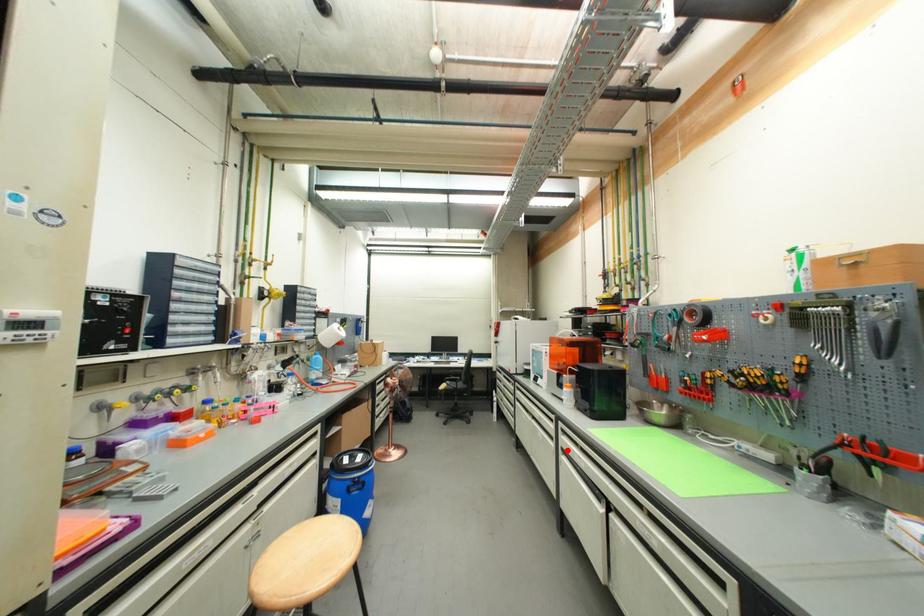
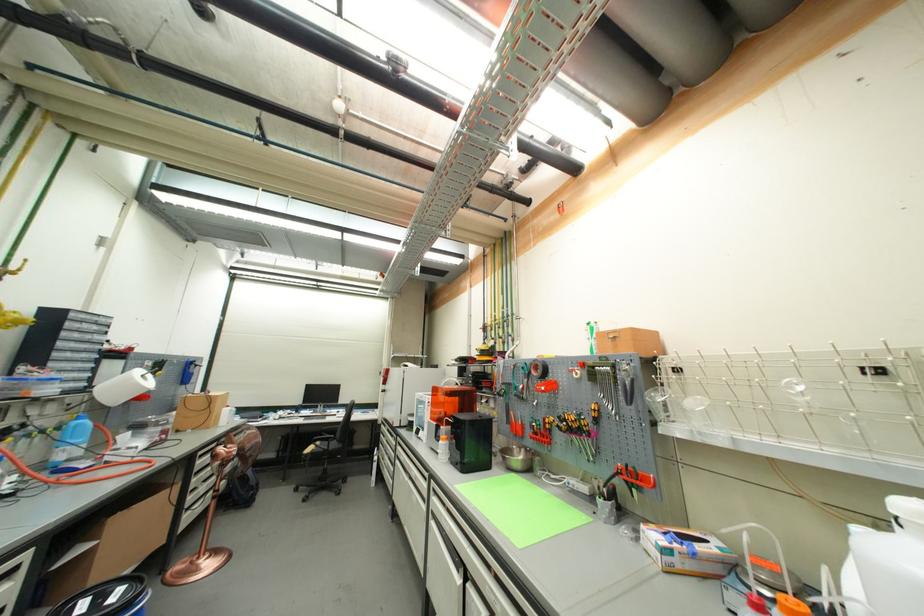
Question: I am providing you with two images of the same scene from different viewpoints. In image1, a red point is highlighted. Considering the same 3D point in image2, which of the following is correct?

Choices:
 (A) It is closer
 (B) It is farther

Answer: (B)